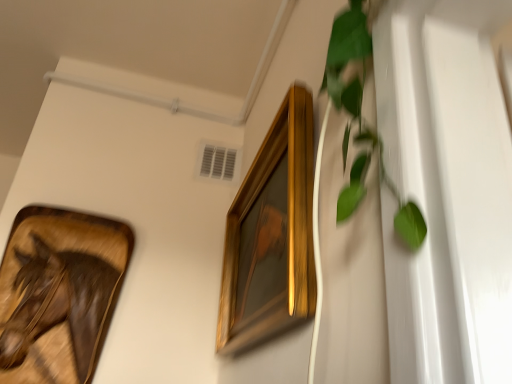
Question: Considering the positions of green leafy plant at right and wooden frame at left, positioned as the 2th picture frame in right-to-left order, in the image, is green leafy plant at right wider or thinner than wooden frame at left, positioned as the 2th picture frame in right-to-left order,?

Choices:
 (A) wide
 (B) thin

Answer: (B)

Question: Do you think green leafy plant at right is within wooden frame at left, which appears as the first picture frame when viewed from the left, or outside of it?

Choices:
 (A) outside
 (B) inside

Answer: (A)

Question: Based on their relative distances, which object is farther from the green leafy plant at right?

Choices:
 (A) wooden frame at left, which appears as the first picture frame when viewed from the left
 (B) gold wooden picture frame at upper center, arranged as the first picture frame when viewed from the right

Answer: (A)

Question: Which of these objects is positioned farthest from the wooden frame at left, which appears as the first picture frame when viewed from the left?

Choices:
 (A) gold wooden picture frame at upper center, arranged as the first picture frame when viewed from the right
 (B) green leafy plant at right

Answer: (B)